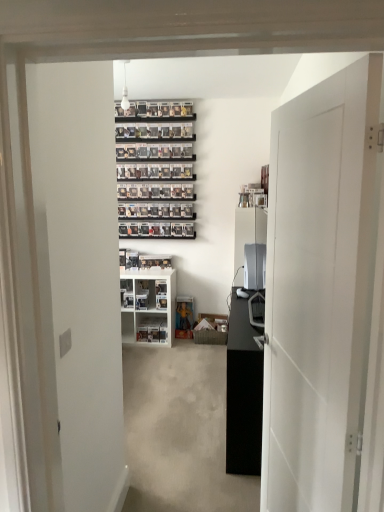
Question: Considering the positions of point coord(244,286) and point coord(251,409), is point coord(244,286) closer or farther from the camera than point coord(251,409)?

Choices:
 (A) farther
 (B) closer

Answer: (A)

Question: Looking at their shapes, would you say satin silver desktop at center is wider or thinner than black matte cabinet at center?

Choices:
 (A) thin
 (B) wide

Answer: (B)

Question: Based on their relative distances, which object is nearer to the black matte cabinet at center?

Choices:
 (A) white matte door at right
 (B) satin silver desktop at center
 (C) white plastic shelf at center, which is the 2th shelf from bottom to top
 (D) white plastic shelf at center, arranged as the first shelf when ordered from the bottom

Answer: (A)

Question: Estimate the real-world distances between objects in this image. Which object is farther from the black matte cabinet at center?

Choices:
 (A) white matte door at right
 (B) white plastic shelf at center, placed as the 2th shelf when sorted from top to bottom
 (C) satin silver desktop at center
 (D) white plastic shelf at center, acting as the first shelf starting from the top

Answer: (B)